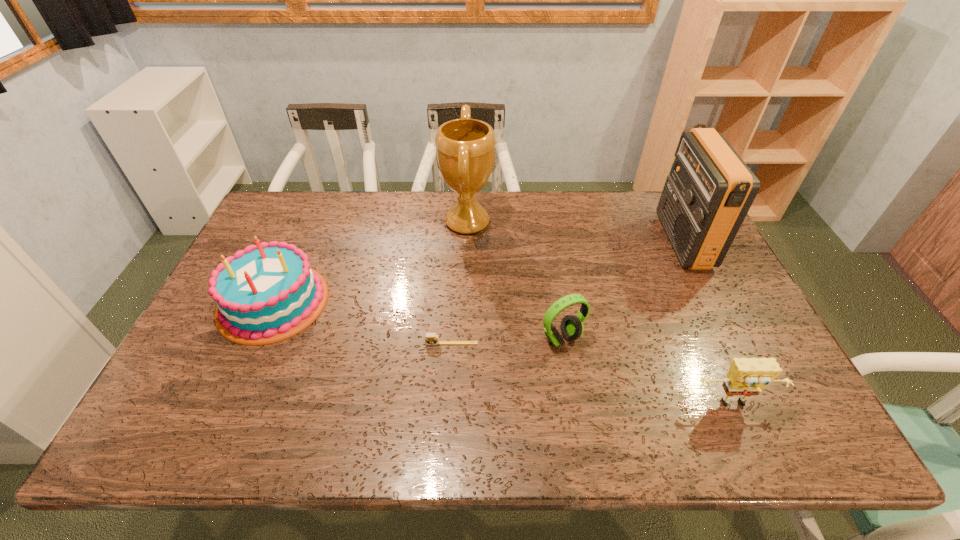
Identify the location of award. (465, 148).

I want to click on radio receiver, so click(710, 189).

Locate an element on the screen. Image resolution: width=960 pixels, height=540 pixels. birthday cake is located at coordinates (266, 293).

The image size is (960, 540). Find the location of `the fourth shortest object`. the fourth shortest object is located at coordinates (266, 293).

The image size is (960, 540). I want to click on headset, so click(x=571, y=327).

Find the location of a particular element. This screenshot has width=960, height=540. the nearest object is located at coordinates (747, 376).

Where is `the shortest object`? the shortest object is located at coordinates (430, 338).

The image size is (960, 540). I want to click on free space located on the front of the award with the decoration, so click(526, 222).

Identify the location of free point located 0.080m on the front-facing side of the radio receiver. [x=640, y=241].

The image size is (960, 540). Identify the location of free point located 0.210m on the front-facing side of the radio receiver. (600, 241).